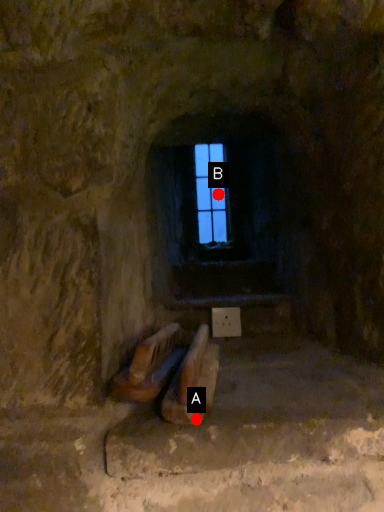
Question: Two points are circled on the image, labeled by A and B beside each circle. Which point is closer to the camera?

Choices:
 (A) A is closer
 (B) B is closer

Answer: (A)